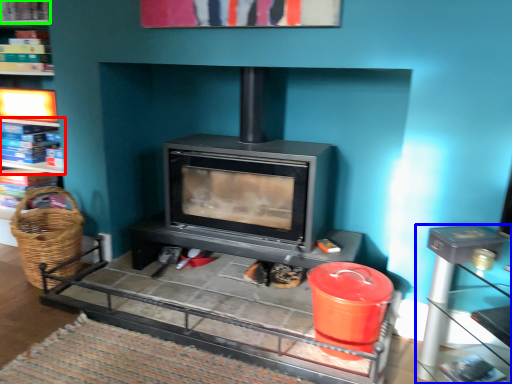
Question: Which is nearer to the shelf (highlighted by a red box)? table (highlighted by a blue box) or shelf (highlighted by a green box).

Choices:
 (A) table
 (B) shelf

Answer: (B)